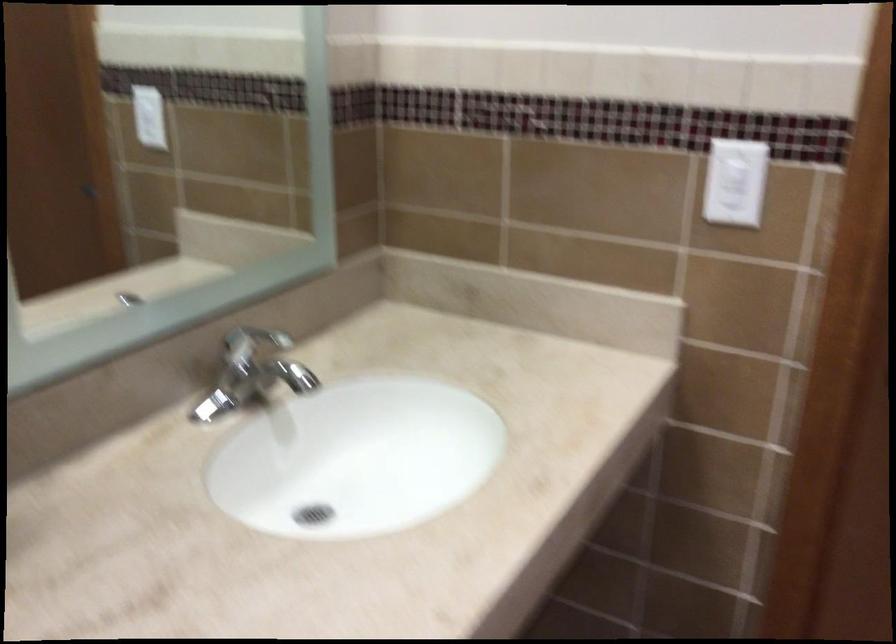
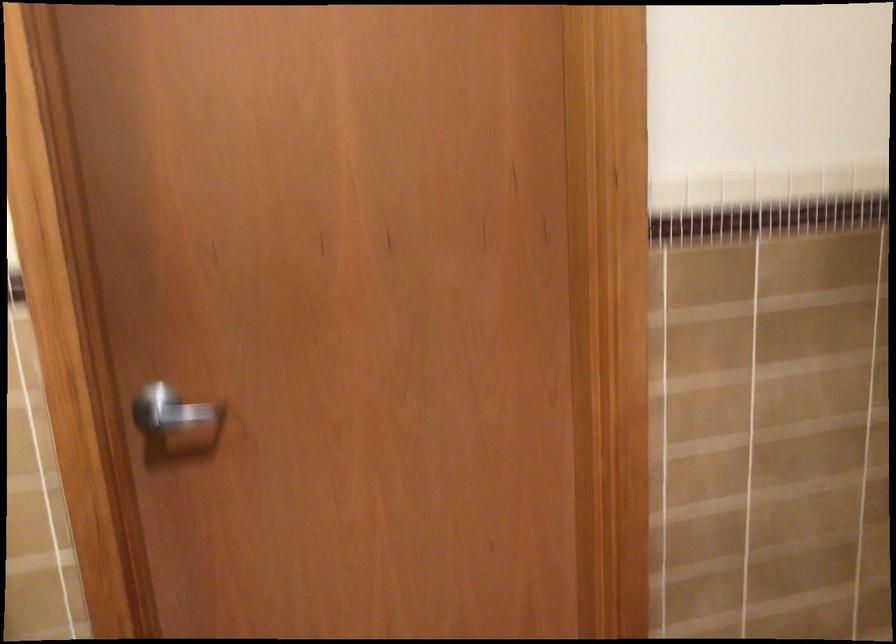
Question: How did the camera likely rotate?

Choices:
 (A) Left
 (B) Right
 (C) Up
 (D) Down

Answer: (B)